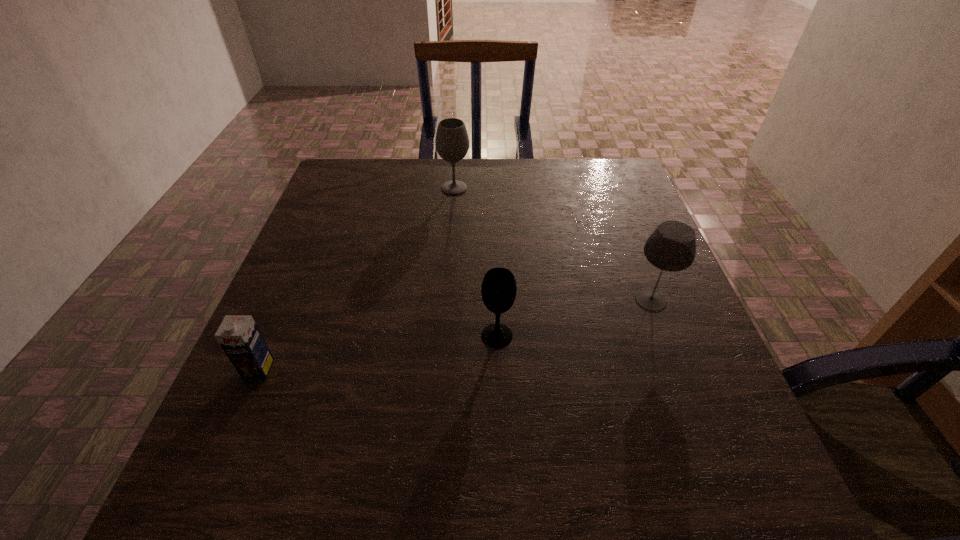
Image resolution: width=960 pixels, height=540 pixels. I want to click on the second object from left to right, so tap(452, 142).

Where is `the leftmost wineglass`? The image size is (960, 540). the leftmost wineglass is located at coordinates [x=452, y=142].

This screenshot has height=540, width=960. Find the location of `the rightmost object`. the rightmost object is located at coordinates (671, 247).

I want to click on the second farthest object, so click(671, 247).

In order to click on the third tallest object in this screenshot , I will do `click(499, 288)`.

You are a GUI agent. You are given a task and a screenshot of the screen. Output one action in this format:
    pyautogui.click(x=<x>, y=<y>)
    Task: Click on the third farthest object
    The width and height of the screenshot is (960, 540).
    Given the screenshot: What is the action you would take?
    pyautogui.click(x=499, y=288)

Find the location of a particular element. The width and height of the screenshot is (960, 540). the leftmost object is located at coordinates (238, 335).

The image size is (960, 540). I want to click on the nearest object, so click(238, 335).

You are a GUI agent. You are given a task and a screenshot of the screen. Output one action in this format:
    pyautogui.click(x=<x>, y=<y>)
    Task: Click on the free space located 0.310m on the left of the leftmost wineglass
    This screenshot has width=960, height=540.
    Given the screenshot: What is the action you would take?
    pyautogui.click(x=330, y=188)

Locate an element on the screen. Image resolution: width=960 pixels, height=540 pixels. vacant space situated 0.140m on the back of the third nearest object is located at coordinates (630, 245).